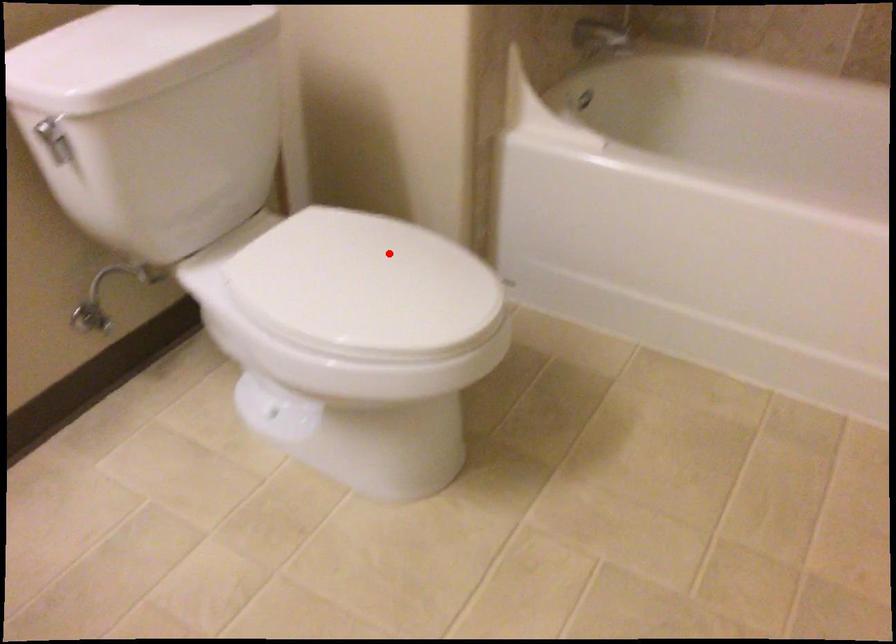
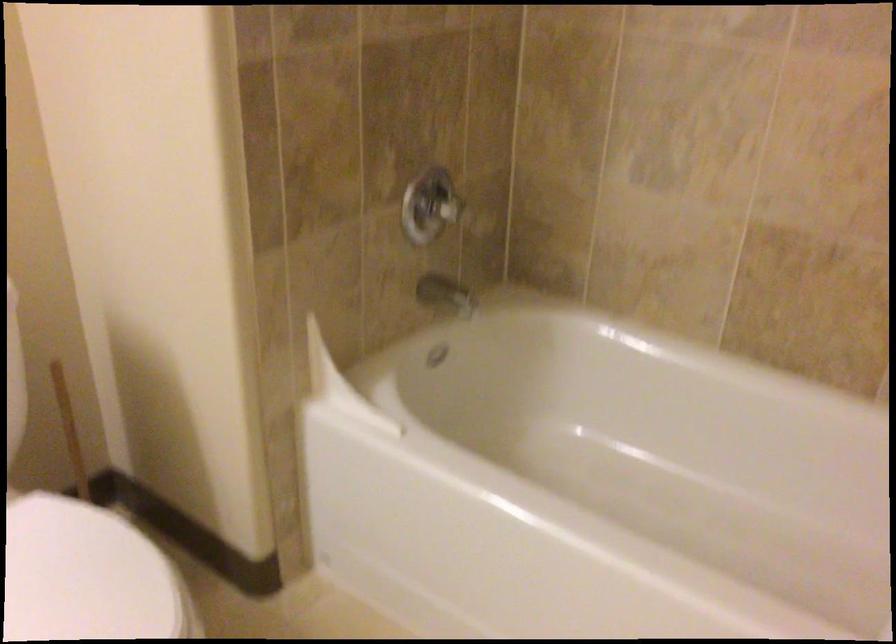
Question: A red point is marked in image1. In image2, is the corresponding 3D point closer to the camera or farther? Reply with the corresponding letter.

Choices:
 (A) The corresponding 3D point is closer.
 (B) The corresponding 3D point is farther.

Answer: (A)